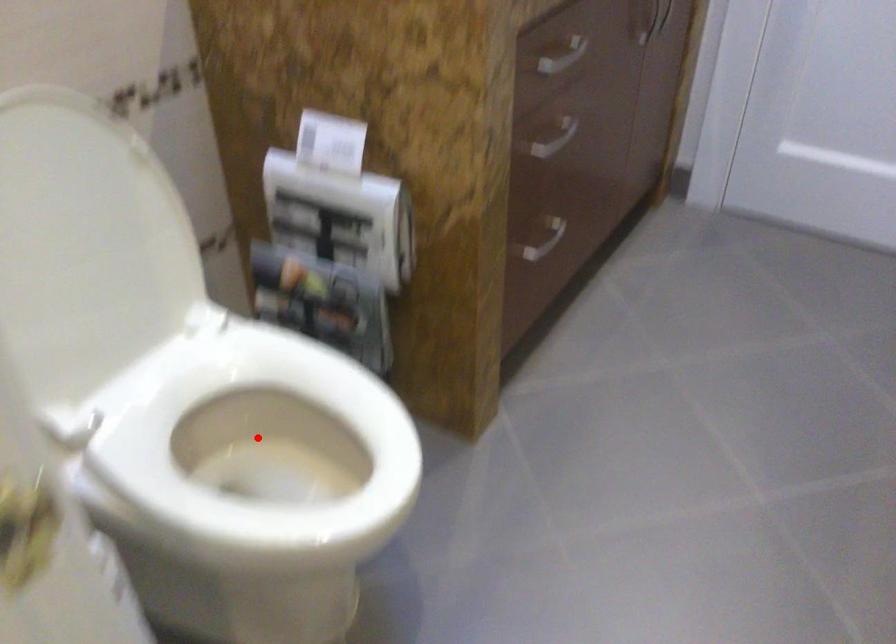
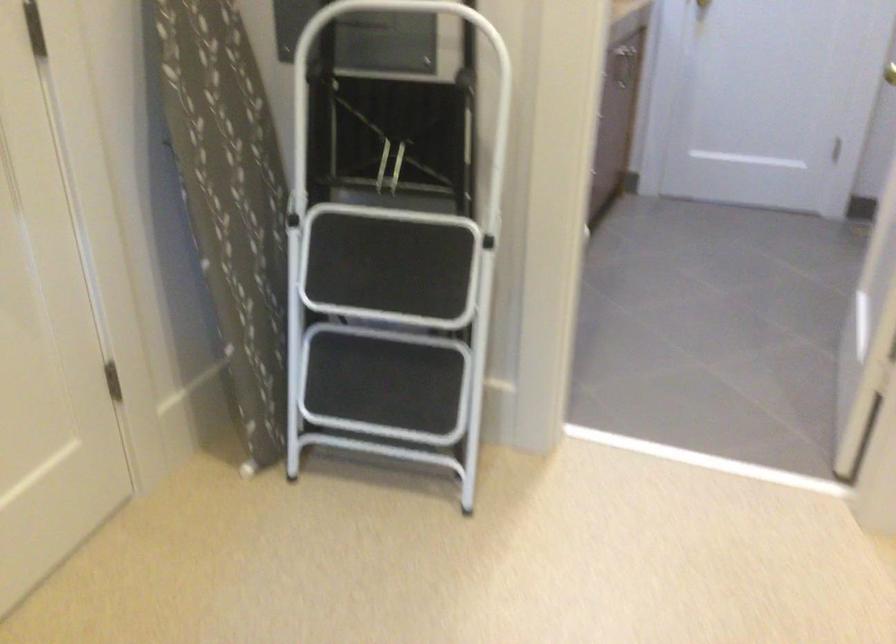
Question: I am providing you with two images of the same scene from different viewpoints. A red point is marked on the first image. Can you still see the location of the red point in image 2?

Choices:
 (A) Yes
 (B) No

Answer: (B)